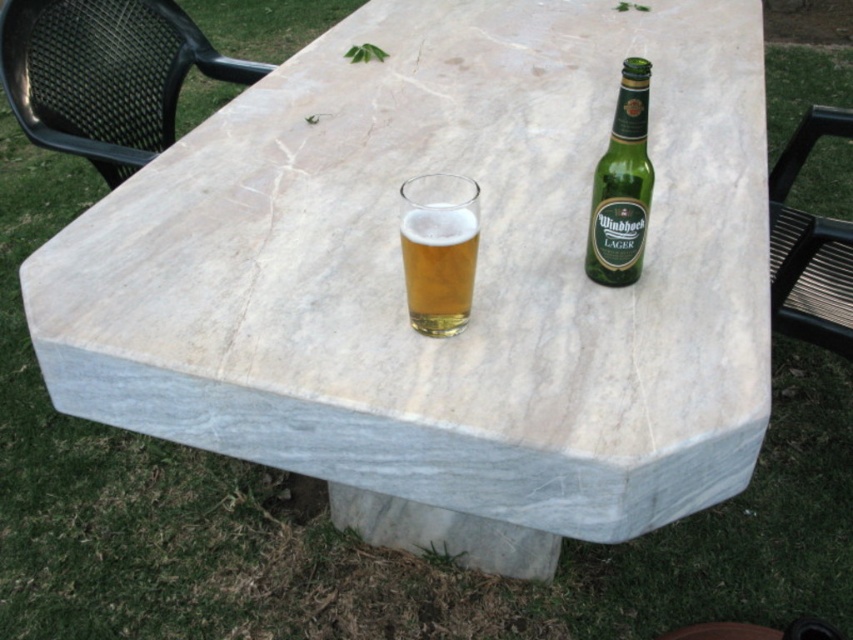
Can you confirm if black plastic chair at right is smaller than green glass bottle at upper right?

Actually, black plastic chair at right might be larger than green glass bottle at upper right.

Does black plastic chair at right have a larger size compared to green glass bottle at upper right?

Indeed, black plastic chair at right has a larger size compared to green glass bottle at upper right.

Which is behind, point (831, 241) or point (601, 211)?

Point (831, 241)

You are a GUI agent. You are given a task and a screenshot of the screen. Output one action in this format:
    pyautogui.click(x=<x>, y=<y>)
    Task: Click on the black plastic chair at right
    This screenshot has width=853, height=640.
    Given the screenshot: What is the action you would take?
    click(810, 246)

Is point (132, 147) more distant than point (848, 291)?

That is True.

Which is more to the right, black mesh chair at upper left or black plastic chair at right?

black plastic chair at right

Who is more forward, (x=4, y=52) or (x=792, y=164)?

Positioned in front is point (x=4, y=52).

Identify the location of black mesh chair at upper left. (103, 76).

Who is more distant from viewer, (781, 163) or (425, 227)?

The point (781, 163) is more distant.

Find the location of a particular element. The width and height of the screenshot is (853, 640). black plastic chair at right is located at coordinates (810, 246).